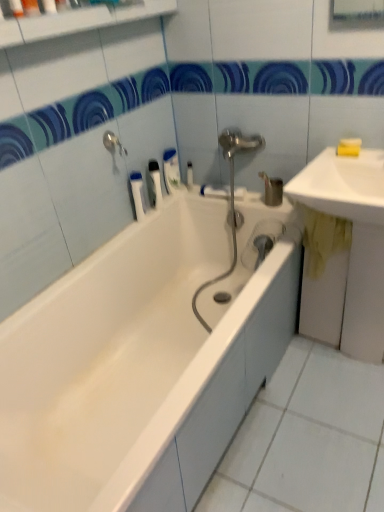
At what (x,y) coordinates should I click in order to perform the action: click on vacant region in front of white plastic bottle at upper center, which ranks as the 1th toiletry in back-to-front order. Please return your answer as a coordinate pair (x, y). Looking at the image, I should click on coord(202,197).